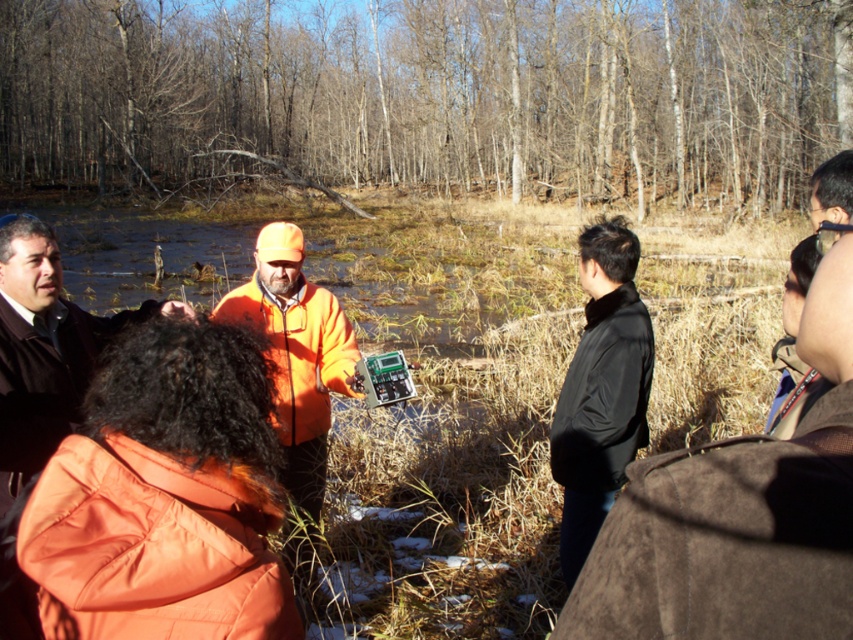
Based on the photo, you are a photographer trying to capture a group photo of the orange puffy jacket at lower left and the brown leather jacket at upper right. If you want to ensure both jackets are fully visible in the frame, which jacket should you position closer to the camera to avoid cropping?

Since the orange puffy jacket at lower left is narrower than the brown leather jacket at upper right, positioning the orange puffy jacket at lower left closer to the camera would help ensure both jackets are fully visible without cropping.

You are standing in a marshy area with a group of people. There are two points marked in the scene. Which point is closer to you, point (799,188) or point (837,230)?

Point (799,188) is closer to you because it is further to the viewer than point (837,230).